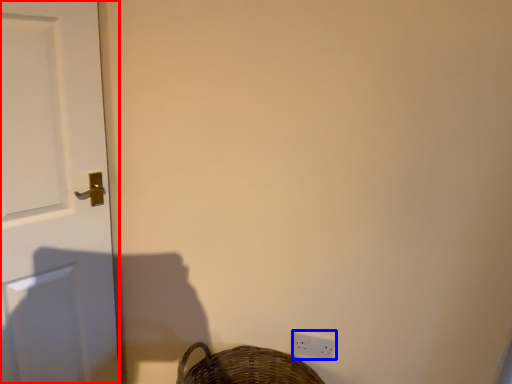
Question: Which of the following is the closest to the observer, door (highlighted by a red box) or light switch (highlighted by a blue box)?

Choices:
 (A) door
 (B) light switch

Answer: (A)